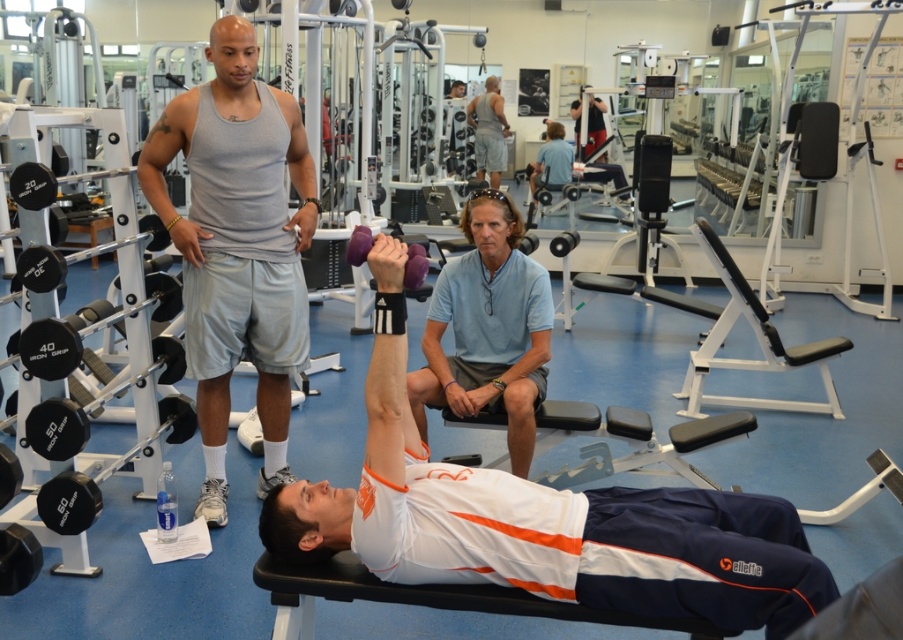
What is located at the point with coordinates (489, 330)?

The light blue cotton polo shirt at center is located at the point with coordinates (489, 330).

You are a personal trainer observing the gym scene. You notice two people wearing different shirts. The first person is wearing a gray cotton tank top at upper left, and the second is wearing a light blue cotton polo shirt at center. Which shirt is higher up in the image?

The gray cotton tank top at upper left is taller than the light blue cotton polo shirt at center, so the gray cotton tank top at upper left is higher up in the image.